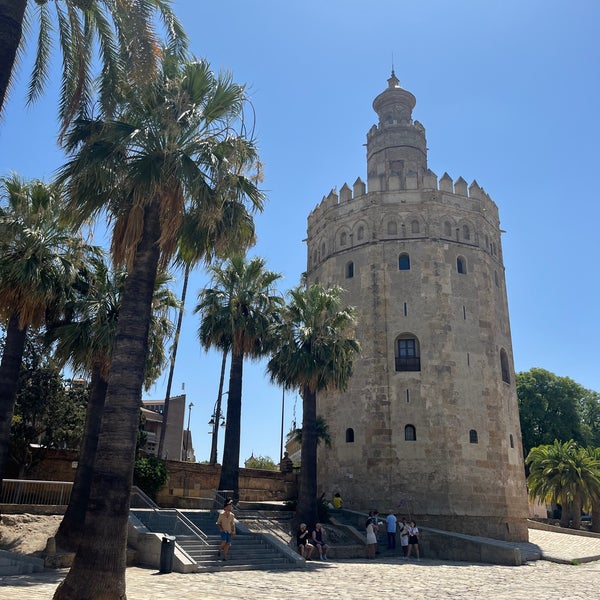
Find the location of `windows`. windows is located at coordinates click(347, 431), click(411, 436), click(475, 435), click(503, 367), click(405, 356), click(404, 261), click(349, 269), click(460, 267).